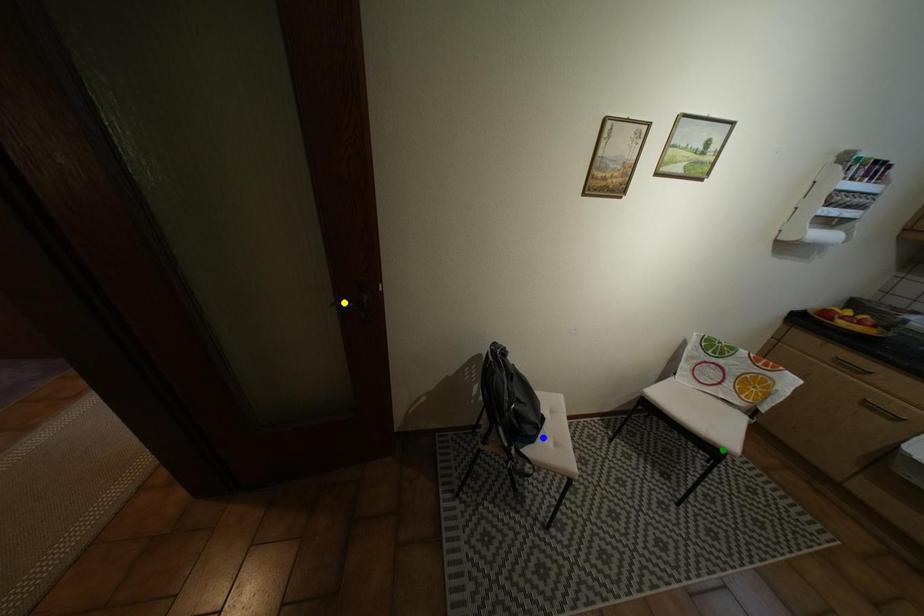
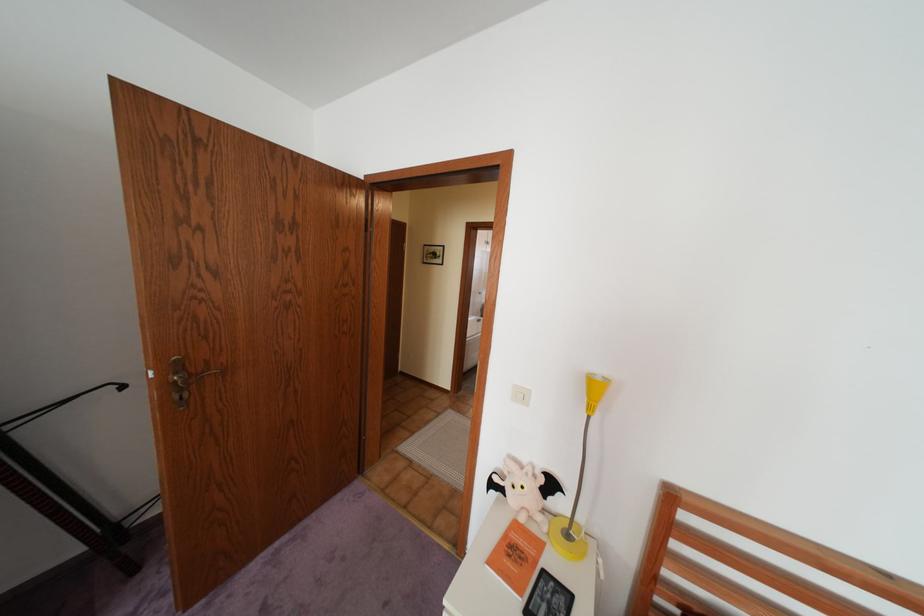
I am providing you with two images of the same scene from different viewpoints. Three points are marked in image1. Which point corresponds to a part or object that is occluded in image2?In image1, three points are marked. Which of them correspond to a part or object that is occluded in image2?Among the three points shown in image1, which one corresponds to a part or object that is no longer visible due to occlusion in image2?

Invisible in image2: blue point, yellow point, green point.